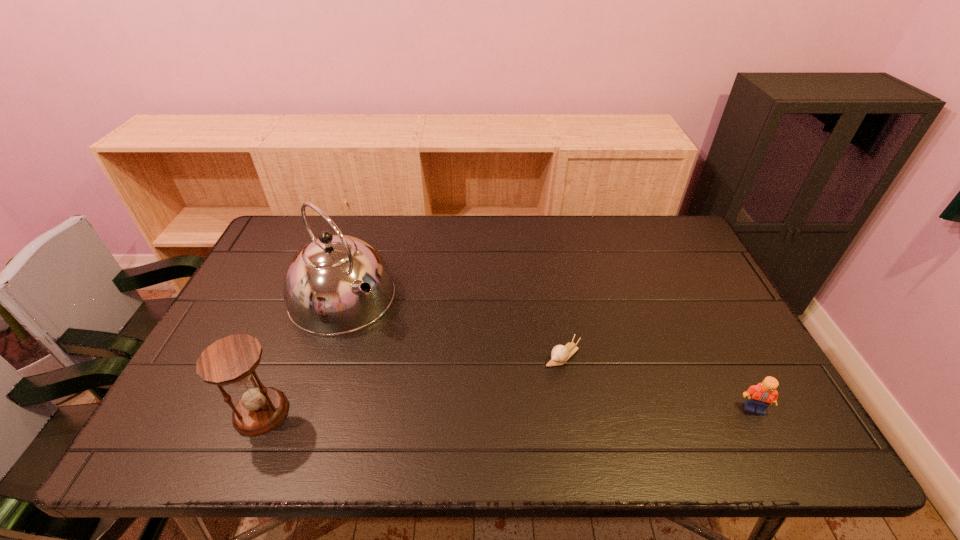
Where is `hourglass`? hourglass is located at coordinates (232, 360).

The height and width of the screenshot is (540, 960). Find the location of `Lego`. Lego is located at coordinates tap(760, 396).

Identify the location of the second shortest object. Image resolution: width=960 pixels, height=540 pixels. (760, 396).

This screenshot has width=960, height=540. I want to click on the tallest object, so click(x=337, y=284).

At what (x,y) coordinates should I click in order to perform the action: click on the farthest object. Please return your answer as a coordinate pair (x, y). This screenshot has width=960, height=540. Looking at the image, I should click on (337, 284).

Locate an element on the screen. The image size is (960, 540). the third nearest object is located at coordinates (560, 354).

Find the location of `escargot`. escargot is located at coordinates (560, 354).

Identify the location of blank area located on the right of the hourglass. (319, 413).

The width and height of the screenshot is (960, 540). In order to click on blank area located from the spout of the farthest object in this screenshot , I will do `click(419, 369)`.

Locate an element on the screen. The width and height of the screenshot is (960, 540). vacant space situated 0.320m from the spout of the farthest object is located at coordinates (447, 397).